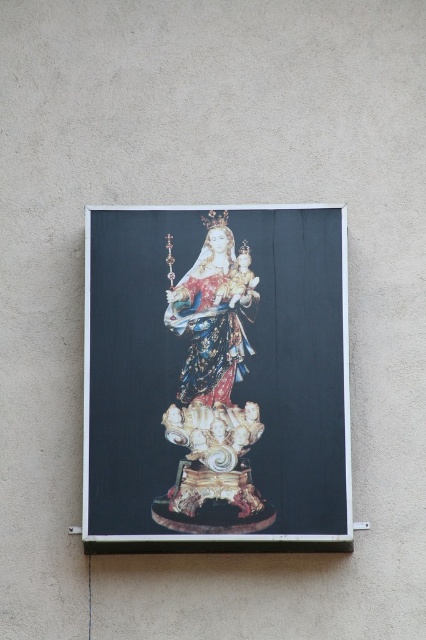
What is the significance of the point marked at coordinates (215, 378) in the image?

The point marked at coordinates (215, 378) marks the gold gilded statue at center.